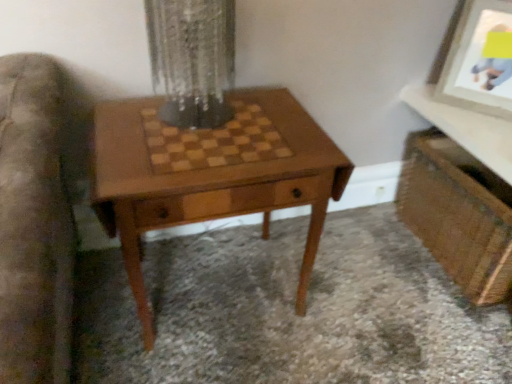
The width and height of the screenshot is (512, 384). What do you see at coordinates (466, 128) in the screenshot? I see `wooden chessboard at upper right` at bounding box center [466, 128].

What do you see at coordinates (478, 62) in the screenshot?
I see `matte white picture frame at upper right` at bounding box center [478, 62].

Identify the location of clear glass vase at center. (192, 59).

At what (x,y) coordinates should I click in order to perform the action: click on wooden vanity at lower right. Please return your answer as a coordinate pair (x, y). Looking at the image, I should click on (459, 196).

From the image's perspective, is wooden chessboard at upper right positioned above or below clear glass vase at center?

From the image's perspective, wooden chessboard at upper right appears below clear glass vase at center.

Is wooden chessboard at upper right facing towards clear glass vase at center?

No, wooden chessboard at upper right is not turned towards clear glass vase at center.

Is wooden chessboard at upper right inside the boundaries of clear glass vase at center, or outside?

wooden chessboard at upper right is spatially situated outside clear glass vase at center.

Between wooden chessboard at upper right and clear glass vase at center, which one has larger width?

With larger width is wooden chessboard at upper right.

Is matte white picture frame at upper right bigger than wooden vanity at lower right?

Actually, matte white picture frame at upper right might be smaller than wooden vanity at lower right.

Does point (487, 81) come farther from viewer compared to point (464, 172)?

No, it is not.

Considering the positions of objects matte white picture frame at upper right and wooden vanity at lower right in the image provided, who is more to the right, matte white picture frame at upper right or wooden vanity at lower right?

wooden vanity at lower right is more to the right.

Is matte white picture frame at upper right positioned beyond the bounds of wooden vanity at lower right?

Absolutely, matte white picture frame at upper right is external to wooden vanity at lower right.

From the picture: Is wooden vanity at lower right to the left of wooden chessboard at upper right from the viewer's perspective?

In fact, wooden vanity at lower right is to the right of wooden chessboard at upper right.

Is wooden vanity at lower right turned away from wooden chessboard at upper right?

No, wooden vanity at lower right's orientation is not away from wooden chessboard at upper right.

Is wooden vanity at lower right further to the viewer compared to wooden chessboard at upper right?

Yes, wooden vanity at lower right is behind wooden chessboard at upper right.

Between wooden vanity at lower right and wooden chessboard at upper right, which one has larger width?

Wider between the two is wooden chessboard at upper right.

Does wooden chessboard at upper right have a greater height compared to matte white picture frame at upper right?

Incorrect, the height of wooden chessboard at upper right is not larger of that of matte white picture frame at upper right.

From a real-world perspective, is wooden chessboard at upper right physically located above or below matte white picture frame at upper right?

From a real-world perspective, wooden chessboard at upper right is physically below matte white picture frame at upper right.

Considering the points (504, 156) and (501, 7), which point is in front, point (504, 156) or point (501, 7)?

Positioned in front is point (504, 156).

From the picture: Between wooden chess table at center and matte white picture frame at upper right, which one appears on the right side from the viewer's perspective?

Positioned to the right is matte white picture frame at upper right.

Does wooden chess table at center have a smaller size compared to matte white picture frame at upper right?

Incorrect, wooden chess table at center is not smaller in size than matte white picture frame at upper right.

Considering the relative positions of wooden chess table at center and matte white picture frame at upper right in the image provided, is wooden chess table at center behind matte white picture frame at upper right?

No, wooden chess table at center is closer to the camera.

Is wooden chess table at center directly adjacent to matte white picture frame at upper right?

No, wooden chess table at center is not next to matte white picture frame at upper right.

In terms of height, does matte white picture frame at upper right look taller or shorter compared to wooden chess table at center?

Considering their sizes, matte white picture frame at upper right has less height than wooden chess table at center.

At what (x,y) coordinates should I click in order to perform the action: click on picture frame behind the wooden chess table at center. Please return your answer as a coordinate pair (x, y). This screenshot has height=384, width=512. Looking at the image, I should click on (x=478, y=62).

From the picture: Is matte white picture frame at upper right in contact with wooden chess table at center?

No.

In the scene shown: Is matte white picture frame at upper right facing towards wooden chess table at center?

No, matte white picture frame at upper right is not oriented towards wooden chess table at center.

Between clear glass vase at center and matte white picture frame at upper right, which one appears on the right side from the viewer's perspective?

matte white picture frame at upper right is more to the right.

Does point (202, 32) come closer to viewer compared to point (468, 43)?

That is True.

From the image's perspective, is clear glass vase at center located beneath matte white picture frame at upper right?

Indeed, from the image's perspective, clear glass vase at center is shown beneath matte white picture frame at upper right.

Would you say clear glass vase at center is outside matte white picture frame at upper right?

Indeed, clear glass vase at center is completely outside matte white picture frame at upper right.

This screenshot has height=384, width=512. I want to click on table top that appears behind the clear glass vase at center, so click(x=466, y=128).

Where is `vanity on the right of matte white picture frame at upper right`? This screenshot has height=384, width=512. vanity on the right of matte white picture frame at upper right is located at coordinates (459, 196).

Based on their spatial positions, is wooden chessboard at upper right or clear glass vase at center further from wooden vanity at lower right?

clear glass vase at center lies further to wooden vanity at lower right than the other object.

Considering their positions, is wooden vanity at lower right positioned closer to clear glass vase at center than matte white picture frame at upper right?

wooden vanity at lower right lies closer to clear glass vase at center than the other object.

Based on their spatial positions, is wooden chess table at center or matte white picture frame at upper right further from wooden chessboard at upper right?

Based on the image, wooden chess table at center appears to be further to wooden chessboard at upper right.

Considering their positions, is wooden chess table at center positioned further to matte white picture frame at upper right than wooden chessboard at upper right?

Among the two, wooden chess table at center is located further to matte white picture frame at upper right.

When comparing their distances from matte white picture frame at upper right, does clear glass vase at center or wooden chessboard at upper right seem closer?

wooden chessboard at upper right.

Considering their positions, is wooden chess table at center positioned closer to wooden vanity at lower right than clear glass vase at center?

The object closer to wooden vanity at lower right is wooden chess table at center.

Which object lies nearer to the anchor point clear glass vase at center, wooden vanity at lower right or wooden chessboard at upper right?

wooden chessboard at upper right is closer to clear glass vase at center.

From the image, which object appears to be nearer to matte white picture frame at upper right, clear glass vase at center or wooden vanity at lower right?

Based on the image, wooden vanity at lower right appears to be nearer to matte white picture frame at upper right.

Locate an element on the screen. The height and width of the screenshot is (384, 512). nightstand located between clear glass vase at center and matte white picture frame at upper right in the left-right direction is located at coordinates (211, 174).

Find the location of a particular element. Image resolution: width=512 pixels, height=384 pixels. table top between matte white picture frame at upper right and wooden vanity at lower right in the vertical direction is located at coordinates (466, 128).

This screenshot has width=512, height=384. I want to click on picture frame located between wooden chess table at center and wooden chessboard at upper right in the left-right direction, so click(x=478, y=62).

Identify the location of picture frame located between wooden chess table at center and wooden vanity at lower right in the left-right direction. The width and height of the screenshot is (512, 384). 478,62.